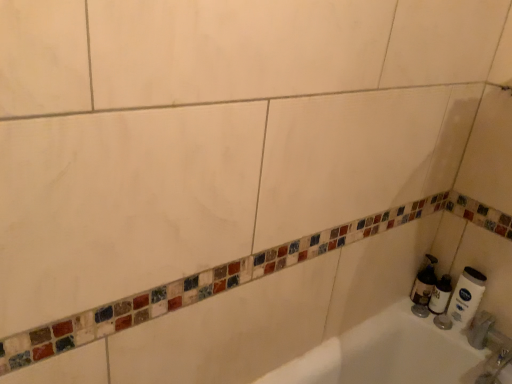
Question: Can you confirm if white matte tube at right, which is the second toilet paper in left-to-right order, is positioned to the left of white matte toilet paper at right, which ranks as the first toilet paper in left-to-right order?

Choices:
 (A) yes
 (B) no

Answer: (B)

Question: From the image's perspective, does white matte tube at right, which is the second toilet paper in left-to-right order, appear lower than white matte toilet paper at right, which ranks as the first toilet paper in left-to-right order?

Choices:
 (A) no
 (B) yes

Answer: (B)

Question: Considering the relative positions of white matte tube at right, which appears as the 1th toilet paper when viewed from the right, and white matte toilet paper at right, which ranks as the first toilet paper in left-to-right order, in the image provided, is white matte tube at right, which appears as the 1th toilet paper when viewed from the right, to the right of white matte toilet paper at right, which ranks as the first toilet paper in left-to-right order, from the viewer's perspective?

Choices:
 (A) no
 (B) yes

Answer: (B)

Question: Can you confirm if white matte tube at right, which appears as the 1th toilet paper when viewed from the right, is thinner than white matte toilet paper at right, which is the second toilet paper from right to left?

Choices:
 (A) yes
 (B) no

Answer: (A)

Question: From the image's perspective, is white matte tube at right, which appears as the 1th toilet paper when viewed from the right, over white matte toilet paper at right, which ranks as the first toilet paper in left-to-right order?

Choices:
 (A) yes
 (B) no

Answer: (B)

Question: Could white matte toilet paper at right, which ranks as the first toilet paper in left-to-right order, be considered to be inside white matte tube at right, which appears as the 1th toilet paper when viewed from the right?

Choices:
 (A) no
 (B) yes

Answer: (A)

Question: Is white matte toilet paper at right, which ranks as the first toilet paper in left-to-right order, at the back of translucent plastic soap dispenser at lower right?

Choices:
 (A) yes
 (B) no

Answer: (B)

Question: From the image's perspective, is translucent plastic soap dispenser at lower right on white matte toilet paper at right, which ranks as the first toilet paper in left-to-right order?

Choices:
 (A) yes
 (B) no

Answer: (A)

Question: Can you confirm if translucent plastic soap dispenser at lower right is wider than white matte toilet paper at right, which is the second toilet paper from right to left?

Choices:
 (A) no
 (B) yes

Answer: (B)

Question: Can you confirm if translucent plastic soap dispenser at lower right is shorter than white matte toilet paper at right, which ranks as the first toilet paper in left-to-right order?

Choices:
 (A) yes
 (B) no

Answer: (B)

Question: Is translucent plastic soap dispenser at lower right outside white matte toilet paper at right, which ranks as the first toilet paper in left-to-right order?

Choices:
 (A) yes
 (B) no

Answer: (A)

Question: Does translucent plastic soap dispenser at lower right touch white matte toilet paper at right, which ranks as the first toilet paper in left-to-right order?

Choices:
 (A) yes
 (B) no

Answer: (A)

Question: Can you confirm if translucent plastic soap dispenser at lower right is smaller than white matte tube at right, which appears as the 1th toilet paper when viewed from the right?

Choices:
 (A) yes
 (B) no

Answer: (B)